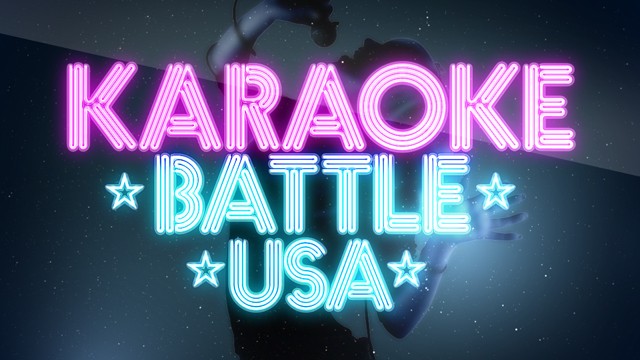
Where is `dark gray color on wall`? This screenshot has width=640, height=360. dark gray color on wall is located at coordinates (569, 190).